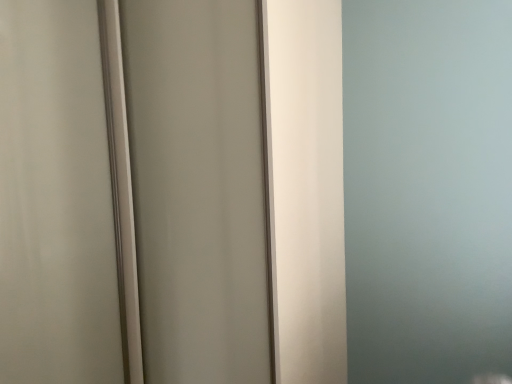
Question: Considering the positions of white glossy screen door at center, which ranks as the first screen door in left-to-right order, and matte white screen door at center, marked as the first screen door in a right-to-left arrangement, in the image, is white glossy screen door at center, which ranks as the first screen door in left-to-right order, taller or shorter than matte white screen door at center, marked as the first screen door in a right-to-left arrangement,?

Choices:
 (A) tall
 (B) short

Answer: (B)

Question: Is point (16, 236) closer or farther from the camera than point (208, 87)?

Choices:
 (A) closer
 (B) farther

Answer: (A)

Question: From a real-world perspective, is white glossy screen door at center, which ranks as the first screen door in left-to-right order, positioned above or below matte white screen door at center, which is counted as the second screen door, starting from the left?

Choices:
 (A) below
 (B) above

Answer: (B)

Question: Is matte white screen door at center, which is counted as the second screen door, starting from the left, situated inside white glossy screen door at center, which ranks as the first screen door in left-to-right order, or outside?

Choices:
 (A) inside
 (B) outside

Answer: (B)

Question: From a real-world perspective, is matte white screen door at center, which is counted as the second screen door, starting from the left, physically located above or below white glossy screen door at center, which ranks as the first screen door in left-to-right order?

Choices:
 (A) below
 (B) above

Answer: (A)

Question: From the image's perspective, is matte white screen door at center, which is counted as the second screen door, starting from the left, positioned above or below white glossy screen door at center, which is counted as the second screen door, starting from the right?

Choices:
 (A) above
 (B) below

Answer: (A)

Question: Relative to white glossy screen door at center, which is counted as the second screen door, starting from the right, is matte white screen door at center, which is counted as the second screen door, starting from the left, in front or behind?

Choices:
 (A) front
 (B) behind

Answer: (B)